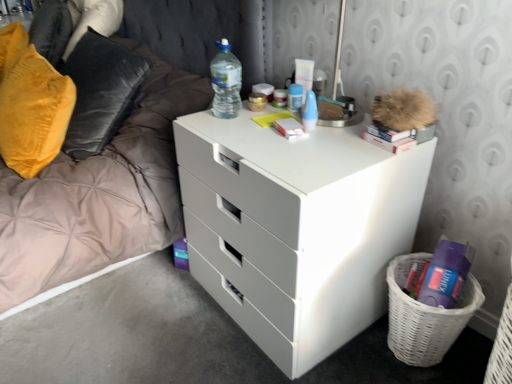
You are a GUI agent. You are given a task and a screenshot of the screen. Output one action in this format:
    pyautogui.click(x=<x>, y=<y>)
    Task: Click on the unoccupied space behind blue plastic spray can at upper center, the first toiletry from the front
    The width and height of the screenshot is (512, 384).
    Given the screenshot: What is the action you would take?
    pyautogui.click(x=290, y=109)